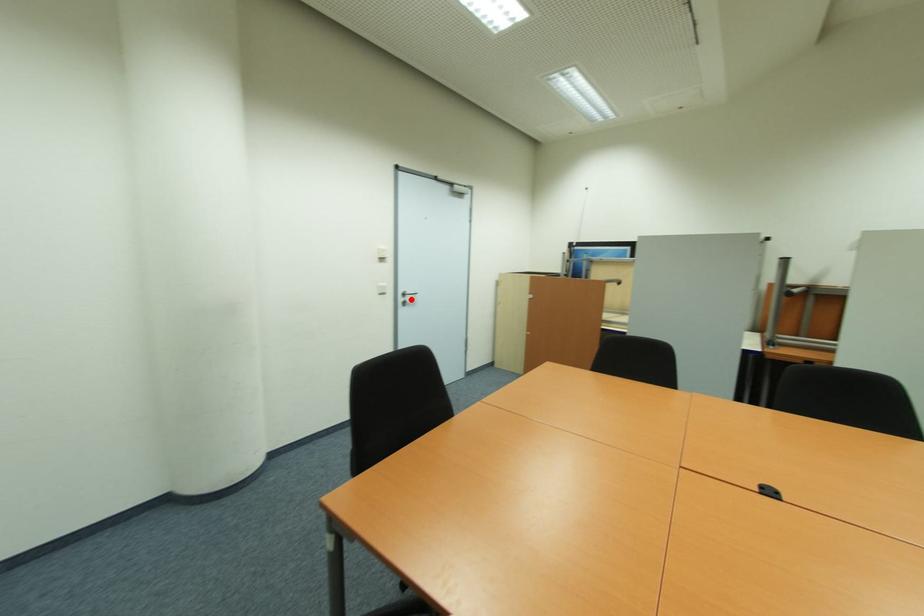
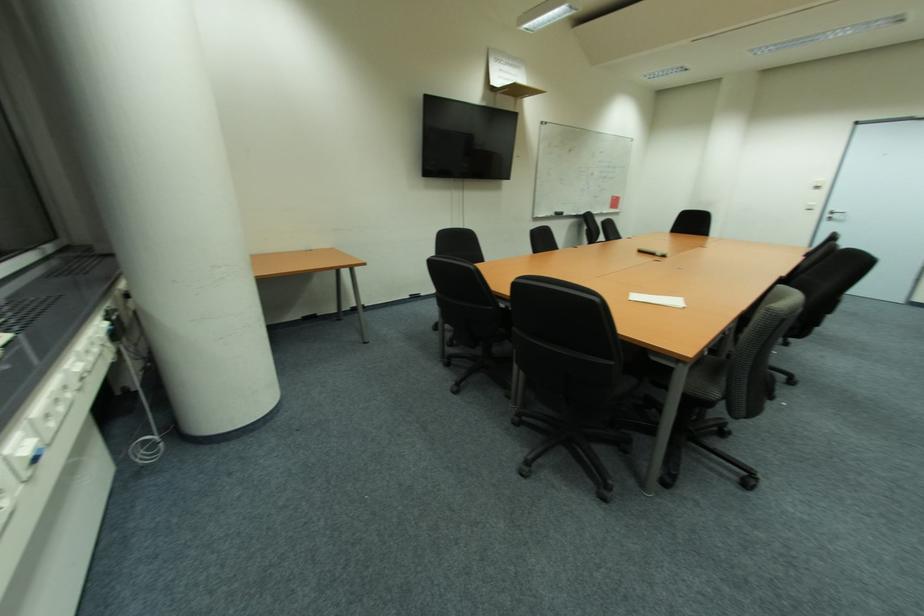
Question: I am providing you with two images of the same scene from different viewpoints. A red point is shown in image1. For the corresponding object point in image2, is it positioned nearer or farther from the camera?

Choices:
 (A) Nearer
 (B) Farther

Answer: (B)